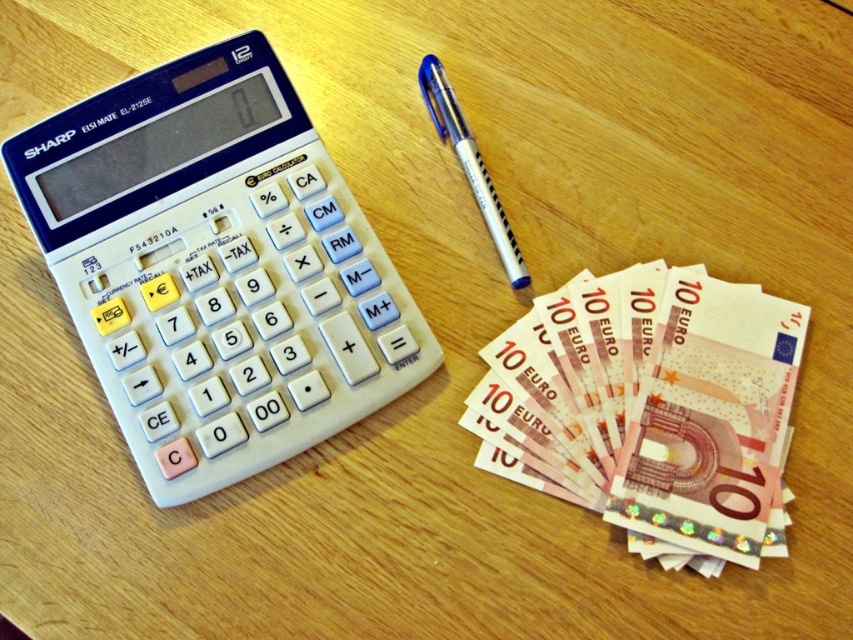
You need to place both the white plastic calculator at upper left and the pink paper money at lower right into a small envelope that can only fit items smaller than the calculator. Which item can be placed inside the envelope?

The pink paper money at lower right can be placed inside the envelope because it is smaller than the white plastic calculator at upper left.

Consider the image. You are at a cash register and need to calculate the total cost of an item priced at 15 euros. The tax rate is 20 percent. You have the white plastic calculator at upper left and the pink paper money at lower right. Which item should you use to perform the calculation?

You should use the white plastic calculator at upper left to perform the calculation since it is designed for arithmetic operations, while the pink paper money at lower right is currency and cannot compute tax.